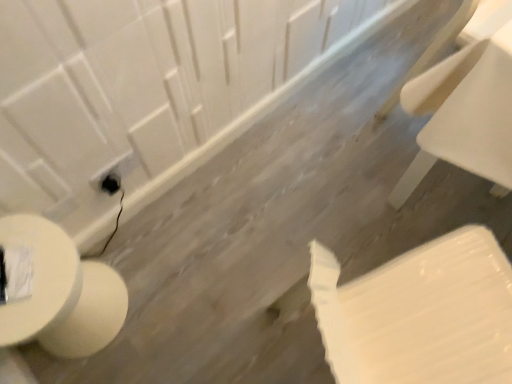
In order to click on free space above white glossy toilet at lower left (from a real-world perspective) in this screenshot , I will do `click(36, 251)`.